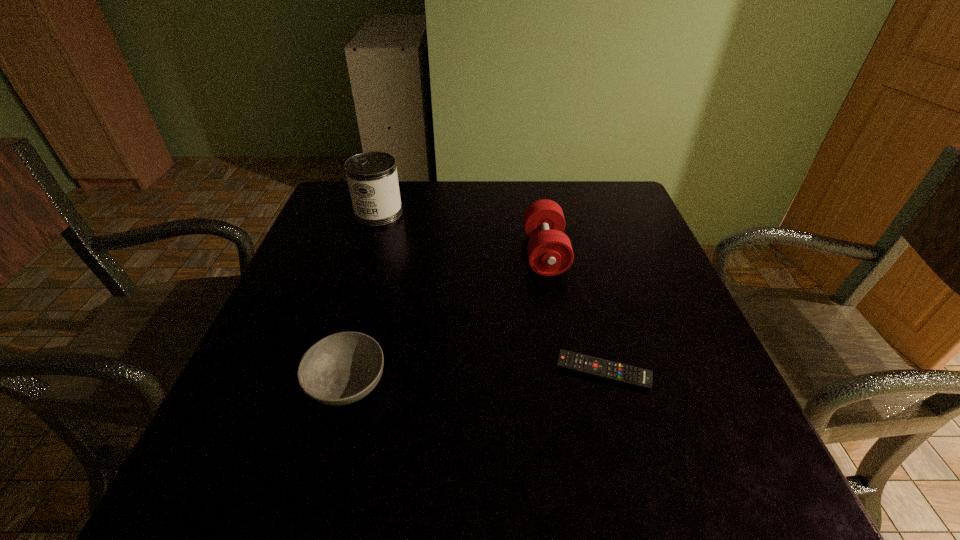
You are a GUI agent. You are given a task and a screenshot of the screen. Output one action in this format:
    pyautogui.click(x=<x>, y=<y>)
    Task: Click on the free space between the bowl and the remote control
    The width and height of the screenshot is (960, 540).
    Given the screenshot: What is the action you would take?
    pyautogui.click(x=475, y=377)

You are a GUI agent. You are given a task and a screenshot of the screen. Output one action in this format:
    pyautogui.click(x=<x>, y=<y>)
    Task: Click on the closest object to the shortest object
    The height and width of the screenshot is (540, 960).
    Given the screenshot: What is the action you would take?
    550,253

Select which object appears as the third closest to the second tallest object. Please provide its 2D coordinates. Your answer should be formatted as a tuple, i.e. [(x, y)], where the tuple contains the x and y coordinates of a point satisfying the conditions above.

[(342, 368)]

At what (x,y) coordinates should I click in order to perform the action: click on free space in the image that satisfies the following two spatial constraints: 1. on the front side of the can; 2. on the left side of the second farthest object. Please return your answer as a coordinate pair (x, y). This screenshot has width=960, height=540. Looking at the image, I should click on (366, 253).

Find the location of `vacant space that satisfies the following two spatial constraints: 1. on the back side of the bowl; 2. on the right side of the dumbbell`. vacant space that satisfies the following two spatial constraints: 1. on the back side of the bowl; 2. on the right side of the dumbbell is located at coordinates (383, 253).

The height and width of the screenshot is (540, 960). Find the location of `vacant area in the image that satisfies the following two spatial constraints: 1. on the back side of the shortest object; 2. on the left side of the third tallest object`. vacant area in the image that satisfies the following two spatial constraints: 1. on the back side of the shortest object; 2. on the left side of the third tallest object is located at coordinates 350,372.